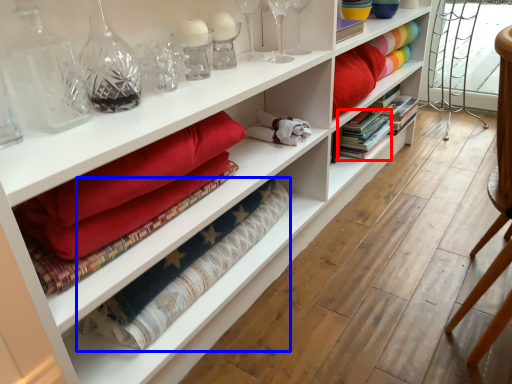
Question: Which point is closer to the camera, book (highlighted by a red box) or material (highlighted by a blue box)?

Choices:
 (A) book
 (B) material

Answer: (B)